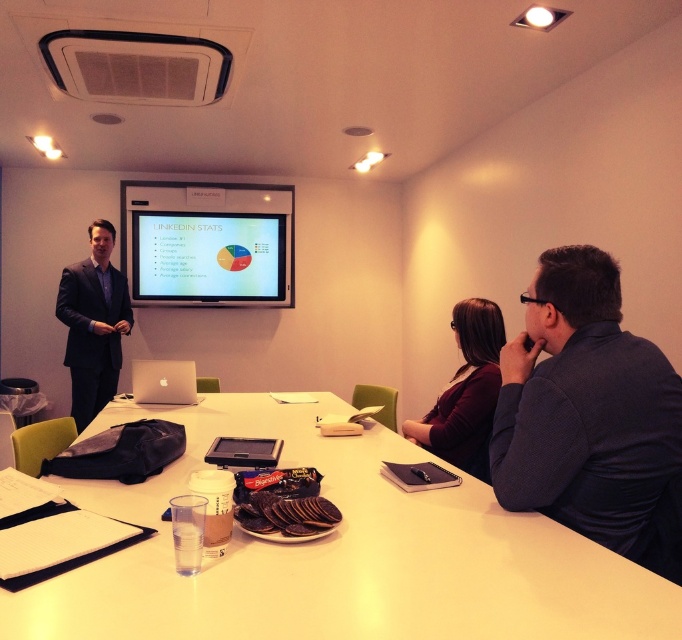
You are a photographer setting up for a video call in the conference room. You need to position your camera so that it is exactly 36.99 inches away from the white glossy table at center. Can you confirm if the current setup allows this?

The white glossy table at center and camera are 36.99 inches apart, so yes, the current setup allows the camera to be positioned exactly 36.99 inches away from the white glossy table at center.

You are setting up a presentation in the conference room. You have a matte plastic projection screen at upper center and a maroon fabric jacket at center. Which object is wider?

The matte plastic projection screen at upper center is wider than the maroon fabric jacket at center according to the description.